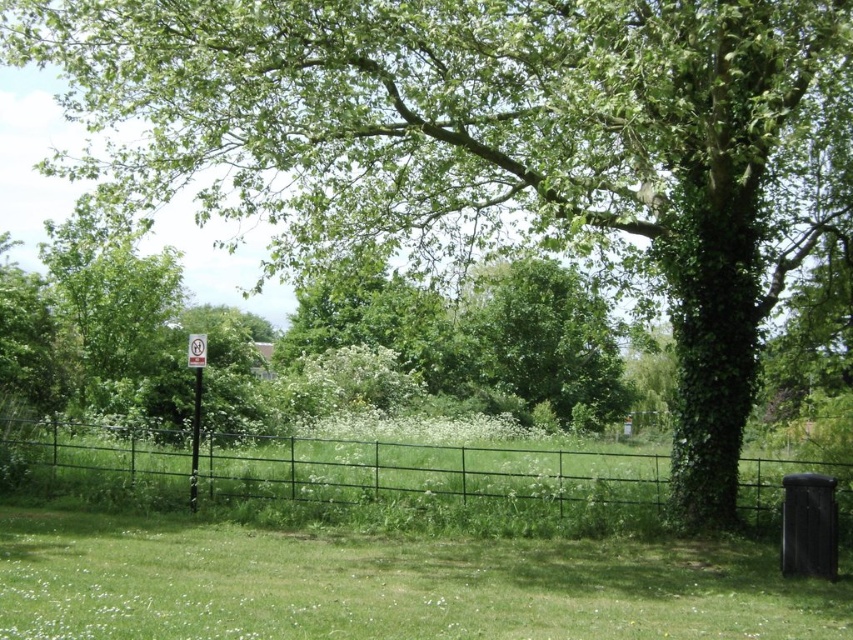
Question: Does green grassy at lower center appear on the left side of green leafy tree at center?

Choices:
 (A) no
 (B) yes

Answer: (B)

Question: Does green grassy at lower center have a lesser width compared to metallic signpost at left?

Choices:
 (A) no
 (B) yes

Answer: (A)

Question: Among these points, which one is farthest from the camera?

Choices:
 (A) (573, 300)
 (B) (463, 602)

Answer: (A)

Question: Which point is farther to the camera?

Choices:
 (A) green leafy tree at center
 (B) metallic signpost at left

Answer: (A)

Question: Which object is positioned farthest from the green grassy at lower center?

Choices:
 (A) metallic signpost at left
 (B) green metal fence at center

Answer: (A)

Question: Is green metal fence at center above metallic signpost at left?

Choices:
 (A) no
 (B) yes

Answer: (A)